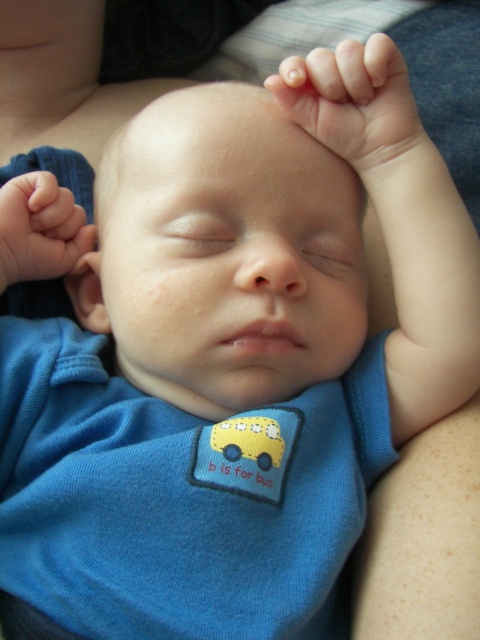
From the picture: Does smooth skin head at center have a lesser width compared to smooth skin hand at upper center?

No, smooth skin head at center is not thinner than smooth skin hand at upper center.

Measure the distance between smooth skin head at center and camera.

They are 17.21 inches apart.

In order to click on smooth skin head at center in this screenshot , I will do coord(224,252).

Between smooth skin head at center and smooth skin hand at left, which one is positioned lower?

smooth skin head at center

This screenshot has height=640, width=480. What do you see at coordinates (224, 252) in the screenshot?
I see `smooth skin head at center` at bounding box center [224, 252].

Find the location of `smooth skin head at center`. smooth skin head at center is located at coordinates (224, 252).

Consider the image. Can you confirm if smooth skin hand at upper center is positioned above smooth skin hand at left?

Indeed, smooth skin hand at upper center is positioned over smooth skin hand at left.

Which is more to the right, smooth skin hand at upper center or smooth skin hand at left?

Positioned to the right is smooth skin hand at upper center.

Who is more forward, (315, 120) or (71, 234)?

Positioned in front is point (315, 120).

The height and width of the screenshot is (640, 480). Identify the location of smooth skin hand at upper center. (352, 100).